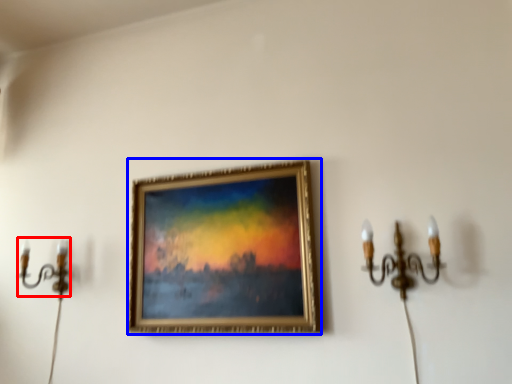
Question: Which of the following is the farthest to the observer, candle holder (highlighted by a red box) or picture frame (highlighted by a blue box)?

Choices:
 (A) candle holder
 (B) picture frame

Answer: (A)